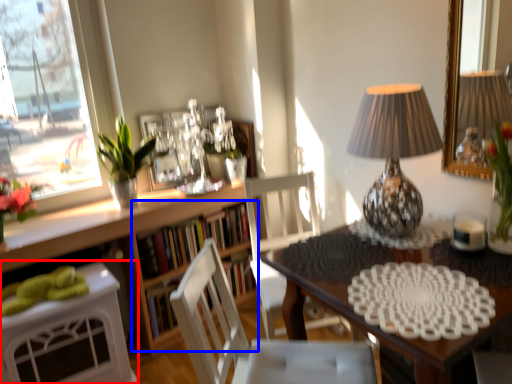
Question: Which point is closer to the camera, desk (highlighted by a red box) or shelf (highlighted by a blue box)?

Choices:
 (A) desk
 (B) shelf

Answer: (A)